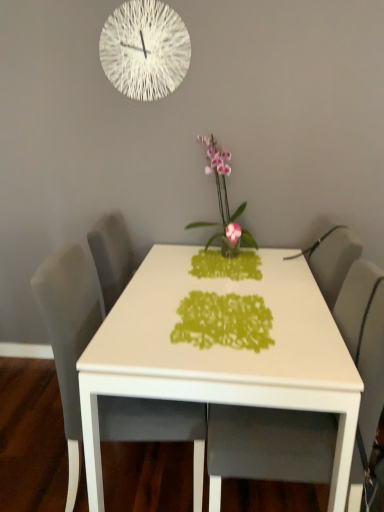
Question: Is gray fabric chair at left, which is the first chair from left to right, facing away from pink glossy orchid at center?

Choices:
 (A) no
 (B) yes

Answer: (A)

Question: From a real-world perspective, does gray fabric chair at left, placed as the 2th chair when sorted from right to left, stand above pink glossy orchid at center?

Choices:
 (A) no
 (B) yes

Answer: (A)

Question: Is gray fabric chair at left, placed as the 2th chair when sorted from right to left, positioned before pink glossy orchid at center?

Choices:
 (A) no
 (B) yes

Answer: (B)

Question: Is gray fabric chair at left, which is the first chair from left to right, next to pink glossy orchid at center and touching it?

Choices:
 (A) no
 (B) yes

Answer: (A)

Question: From the image's perspective, would you say gray fabric chair at left, which is the first chair from left to right, is shown under pink glossy orchid at center?

Choices:
 (A) yes
 (B) no

Answer: (A)

Question: Is gray fabric chair at left, placed as the 2th chair when sorted from right to left, taller than pink glossy orchid at center?

Choices:
 (A) yes
 (B) no

Answer: (A)

Question: Is pink glossy orchid at center located outside gray fabric chair at center, which ranks as the 1th chair in right-to-left order?

Choices:
 (A) no
 (B) yes

Answer: (B)

Question: Does pink glossy orchid at center have a larger size compared to gray fabric chair at center, which ranks as the 2th chair in left-to-right order?

Choices:
 (A) yes
 (B) no

Answer: (B)

Question: Would you say gray fabric chair at center, which ranks as the 1th chair in right-to-left order, is part of pink glossy orchid at center's contents?

Choices:
 (A) yes
 (B) no

Answer: (B)

Question: Considering the relative sizes of pink glossy orchid at center and gray fabric chair at center, which ranks as the 1th chair in right-to-left order, in the image provided, is pink glossy orchid at center shorter than gray fabric chair at center, which ranks as the 1th chair in right-to-left order,?

Choices:
 (A) no
 (B) yes

Answer: (B)

Question: Is gray fabric chair at center, which ranks as the 1th chair in right-to-left order, at the back of pink glossy orchid at center?

Choices:
 (A) no
 (B) yes

Answer: (A)

Question: Is pink glossy orchid at center taller than gray fabric chair at center, which ranks as the 1th chair in right-to-left order?

Choices:
 (A) yes
 (B) no

Answer: (B)

Question: Is green paper cutout at center turned away from white glossy table at center?

Choices:
 (A) no
 (B) yes

Answer: (B)